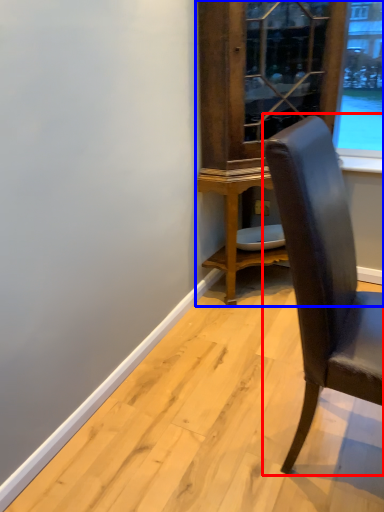
Question: Which of the following is the closest to the observer, chair (highlighted by a red box) or dresser (highlighted by a blue box)?

Choices:
 (A) chair
 (B) dresser

Answer: (A)